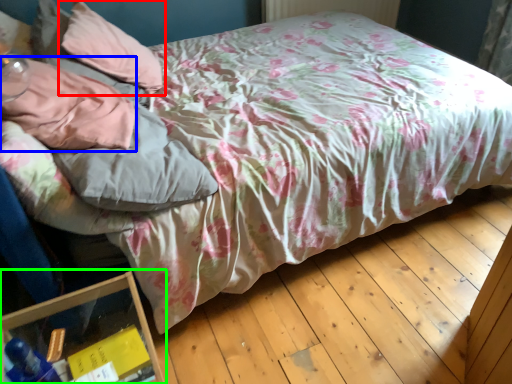
Question: Based on their relative distances, which object is nearer to pillow (highlighted by a red box)? Choose from pillow (highlighted by a blue box) and glass box (highlighted by a green box).

Choices:
 (A) pillow
 (B) glass box

Answer: (A)